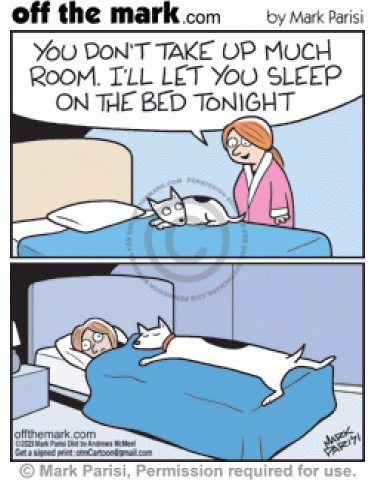
Locate an element on the screen. Image resolution: width=380 pixels, height=480 pixels. pillow is located at coordinates [x=78, y=356], [x=94, y=217].